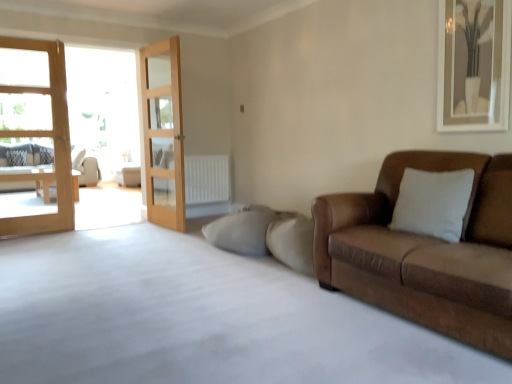
Where is `wooden glass door at center, arranged as the first door when viewed from the right`? The image size is (512, 384). wooden glass door at center, arranged as the first door when viewed from the right is located at coordinates (163, 133).

Locate an element on the screen. Image resolution: width=512 pixels, height=384 pixels. light brown wooden door at left, which is the 2th door from right to left is located at coordinates (46, 136).

The image size is (512, 384). Find the location of `beige fabric couch at left, the 1th studio couch in the left-to-right sequence`. beige fabric couch at left, the 1th studio couch in the left-to-right sequence is located at coordinates (86, 167).

Which is more to the left, white textured radiator at center or light brown wooden door at left, which is the 2th door from right to left?

light brown wooden door at left, which is the 2th door from right to left.

Based on the photo, is white textured radiator at center further to the viewer compared to light brown wooden door at left, positioned as the first door in left-to-right order?

Yes, the depth of white textured radiator at center is greater than that of light brown wooden door at left, positioned as the first door in left-to-right order.

From a real-world perspective, which object stands above the other?

In real-world perspective, light brown wooden door at left, which is the 2th door from right to left, is above.

Can wooden glass door at center, arranged as the 2th door when viewed from the left, be found inside white textured pillow at left?

Definitely not — wooden glass door at center, arranged as the 2th door when viewed from the left, is not inside white textured pillow at left.

Considering the sizes of objects white textured pillow at left and wooden glass door at center, arranged as the 2th door when viewed from the left, in the image provided, who is thinner, white textured pillow at left or wooden glass door at center, arranged as the 2th door when viewed from the left,?

With smaller width is wooden glass door at center, arranged as the 2th door when viewed from the left.

Does point (22, 155) come closer to viewer compared to point (144, 80)?

No, (22, 155) is further to viewer.

Considering the sizes of beige fabric couch at left, the 1th studio couch in the left-to-right sequence, and light brown wooden door at left, positioned as the first door in left-to-right order, in the image, is beige fabric couch at left, the 1th studio couch in the left-to-right sequence, bigger or smaller than light brown wooden door at left, positioned as the first door in left-to-right order,?

Clearly, beige fabric couch at left, the 1th studio couch in the left-to-right sequence, is larger in size than light brown wooden door at left, positioned as the first door in left-to-right order.

From a real-world perspective, between beige fabric couch at left, the 1th studio couch in the back-to-front sequence, and light brown wooden door at left, positioned as the first door in left-to-right order, who is vertically higher?

In real-world perspective, light brown wooden door at left, positioned as the first door in left-to-right order, is above.

From the image's perspective, which one is positioned higher, beige fabric couch at left, positioned as the second studio couch in right-to-left order, or light brown wooden door at left, which is the 2th door from right to left?

From the image's view, beige fabric couch at left, positioned as the second studio couch in right-to-left order, is above.

Which is more to the right, beige fabric couch at left, the 2th studio couch positioned from the front, or light brown wooden door at left, positioned as the first door in left-to-right order?

Positioned to the right is light brown wooden door at left, positioned as the first door in left-to-right order.

Could you tell me if beige fabric couch at left, the 2th studio couch positioned from the front, is facing white textured pillow at left?

No, beige fabric couch at left, the 2th studio couch positioned from the front, is not facing towards white textured pillow at left.

Is point (94, 164) positioned after point (13, 150)?

Yes, it is behind point (13, 150).

You are a GUI agent. You are given a task and a screenshot of the screen. Output one action in this format:
    pyautogui.click(x=<x>, y=<y>)
    Task: Click on the 1st studio couch below the white textured pillow at left (from a real-world perspective)
    
    Given the screenshot: What is the action you would take?
    pyautogui.click(x=86, y=167)

From the image's perspective, does beige fabric couch at left, the 1th studio couch in the left-to-right sequence, appear lower than white textured pillow at left?

Yes, from the image's perspective, beige fabric couch at left, the 1th studio couch in the left-to-right sequence, is beneath white textured pillow at left.

From the image's perspective, is wooden glass door at center, arranged as the 2th door when viewed from the left, located above or below light brown wooden door at left, positioned as the first door in left-to-right order?

From the image's perspective, wooden glass door at center, arranged as the 2th door when viewed from the left, appears above light brown wooden door at left, positioned as the first door in left-to-right order.

Could light brown wooden door at left, positioned as the first door in left-to-right order, be considered to be inside wooden glass door at center, arranged as the first door when viewed from the right?

No, wooden glass door at center, arranged as the first door when viewed from the right, does not contain light brown wooden door at left, positioned as the first door in left-to-right order.

Is wooden glass door at center, arranged as the 2th door when viewed from the left, far away from light brown wooden door at left, which is the 2th door from right to left?

Absolutely, wooden glass door at center, arranged as the 2th door when viewed from the left, is distant from light brown wooden door at left, which is the 2th door from right to left.

Which is in front, wooden glass door at center, arranged as the 2th door when viewed from the left, or light brown wooden door at left, which is the 2th door from right to left?

Positioned in front is light brown wooden door at left, which is the 2th door from right to left.

Based on the photo, who is shorter, wooden glass door at center, arranged as the first door when viewed from the right, or beige fabric couch at left, the 1th studio couch in the left-to-right sequence?

beige fabric couch at left, the 1th studio couch in the left-to-right sequence.

From a real-world perspective, between wooden glass door at center, arranged as the first door when viewed from the right, and beige fabric couch at left, the 2th studio couch positioned from the front, who is vertically lower?

beige fabric couch at left, the 2th studio couch positioned from the front, from a real-world perspective.

Is point (180, 189) farther from camera compared to point (73, 160)?

No, it is in front of (73, 160).

Does white textured radiator at center have a lesser height compared to brown leather couch at right, placed as the 1th studio couch when sorted from right to left?

Yes, white textured radiator at center is shorter than brown leather couch at right, placed as the 1th studio couch when sorted from right to left.

From the picture: Considering the sizes of objects white textured radiator at center and brown leather couch at right, placed as the 1th studio couch when sorted from right to left, in the image provided, who is thinner, white textured radiator at center or brown leather couch at right, placed as the 1th studio couch when sorted from right to left,?

white textured radiator at center.

From the image's perspective, which is above, white textured radiator at center or brown leather couch at right, placed as the 1th studio couch when sorted from right to left?

white textured radiator at center appears higher in the image.

Find the location of `door that is the 2nd object to the left of the white textured radiator at center, starting at the anchor`. door that is the 2nd object to the left of the white textured radiator at center, starting at the anchor is located at coordinates (46, 136).

Which door is the 2nd one when counting from the right side of the white textured pillow at left? Please provide its 2D coordinates.

[(163, 133)]

Estimate the real-world distances between objects in this image. Which object is closer to white textured radiator at center, light brown wooden door at left, positioned as the first door in left-to-right order, or beige fabric couch at left, the 1th studio couch in the back-to-front sequence?

light brown wooden door at left, positioned as the first door in left-to-right order, is closer to white textured radiator at center.

Looking at the image, which one is located closer to wooden glass door at center, arranged as the 2th door when viewed from the left, beige fabric couch at left, positioned as the second studio couch in right-to-left order, or white textured pillow at left?

white textured pillow at left lies closer to wooden glass door at center, arranged as the 2th door when viewed from the left, than the other object.

Considering their positions, is white textured radiator at center positioned further to brown leather couch at right, placed as the 1th studio couch when sorted from right to left, than beige fabric couch at left, the 1th studio couch in the left-to-right sequence?

The object further to brown leather couch at right, placed as the 1th studio couch when sorted from right to left, is beige fabric couch at left, the 1th studio couch in the left-to-right sequence.

When comparing their distances from brown leather couch at right, which appears as the second studio couch when viewed from the back, does wooden glass door at center, arranged as the first door when viewed from the right, or beige fabric couch at left, positioned as the second studio couch in right-to-left order, seem closer?

wooden glass door at center, arranged as the first door when viewed from the right.

Considering their positions, is white textured radiator at center positioned closer to light brown wooden door at left, which is the 2th door from right to left, than wooden glass door at center, arranged as the 2th door when viewed from the left?

The object closer to light brown wooden door at left, which is the 2th door from right to left, is wooden glass door at center, arranged as the 2th door when viewed from the left.

Looking at the image, which one is located closer to light brown wooden door at left, which is the 2th door from right to left, wooden glass door at center, arranged as the first door when viewed from the right, or white textured pillow at left?

The object closer to light brown wooden door at left, which is the 2th door from right to left, is wooden glass door at center, arranged as the first door when viewed from the right.

From the image, which object appears to be farther from white textured radiator at center, white textured pillow at left or wooden glass door at center, arranged as the first door when viewed from the right?

white textured pillow at left lies further to white textured radiator at center than the other object.

Looking at the image, which one is located further to wooden glass door at center, arranged as the 2th door when viewed from the left, brown leather couch at right, the 2th studio couch when ordered from left to right, or white textured radiator at center?

The object further to wooden glass door at center, arranged as the 2th door when viewed from the left, is brown leather couch at right, the 2th studio couch when ordered from left to right.

What are the coordinates of `radiator between light brown wooden door at left, which is the 2th door from right to left, and white textured pillow at left, along the z-axis` in the screenshot? It's located at (207, 179).

This screenshot has width=512, height=384. I want to click on door between light brown wooden door at left, positioned as the first door in left-to-right order, and white textured radiator at center, so click(163, 133).

At what (x,y) coordinates should I click in order to perform the action: click on studio couch between brown leather couch at right, the 2th studio couch when ordered from left to right, and white textured pillow at left, along the z-axis. Please return your answer as a coordinate pair (x, y). This screenshot has width=512, height=384. Looking at the image, I should click on (86, 167).

You are a GUI agent. You are given a task and a screenshot of the screen. Output one action in this format:
    pyautogui.click(x=<x>, y=<y>)
    Task: Click on the studio couch between light brown wooden door at left, which is the 2th door from right to left, and white textured pillow at left in the front-back direction
    
    Given the screenshot: What is the action you would take?
    pyautogui.click(x=86, y=167)